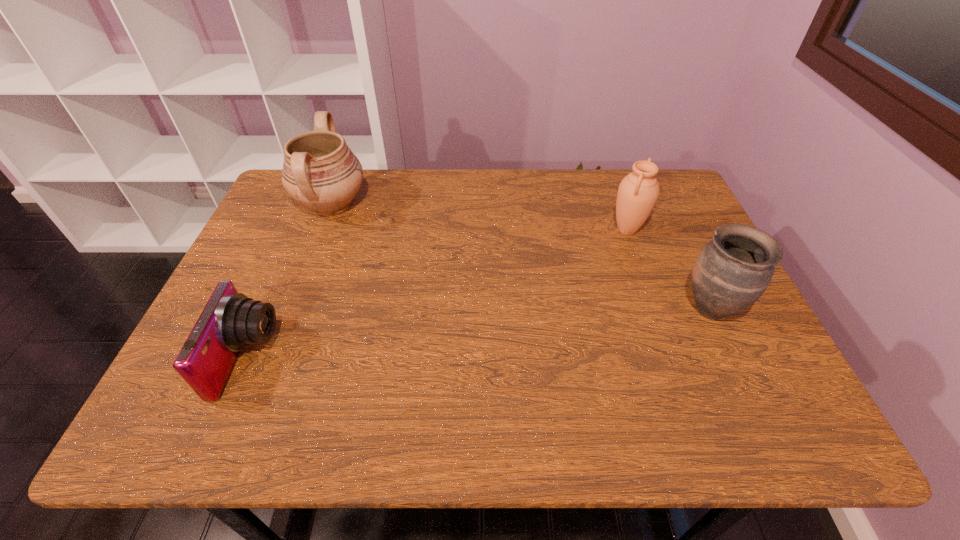
Locate an element on the screen. The image size is (960, 540). free space that satisfies the following two spatial constraints: 1. on the front-facing side of the leftmost urn; 2. on the right side of the nearest urn is located at coordinates point(292,309).

Locate an element on the screen. The height and width of the screenshot is (540, 960). free space that satisfies the following two spatial constraints: 1. on the back side of the nearest urn; 2. on the front-facing side of the leftmost urn is located at coordinates (661, 205).